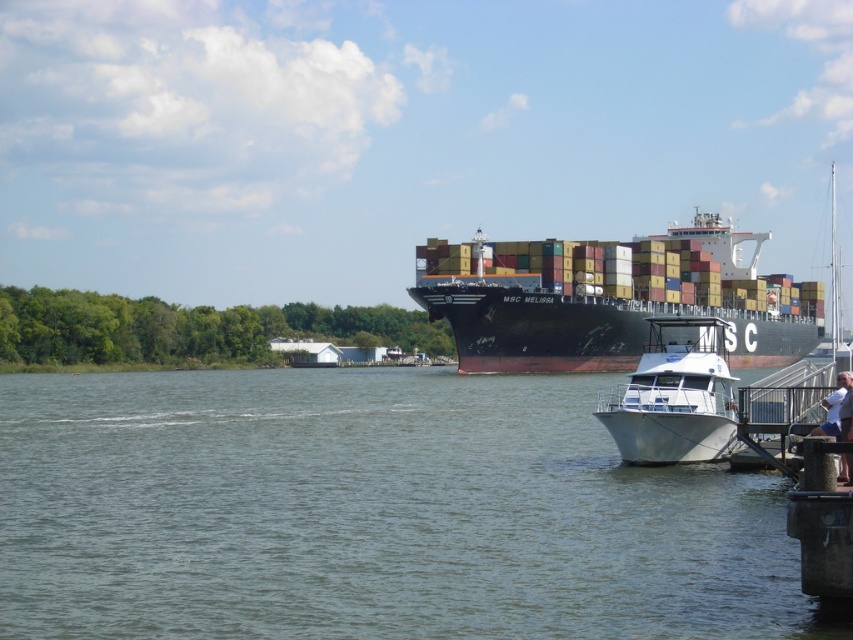
You are a photographer standing on the pier and want to capture both the greenish water at lower left and the black matte container ship at center in your shot. Which object should you position closer to the left side of your camera frame?

You should position the greenish water at lower left closer to the left side of your camera frame since it is located to the left of the black matte container ship at center.

You are standing on the riverside and want to take a photo of both the greenish water at lower left and the white glossy boat at lower right. Which object should you focus on first to ensure both are in clear view?

You should focus on the greenish water at lower left first because it is closer to the viewer than the white glossy boat at lower right, so adjusting focus from near to far will help both objects stay sharp.